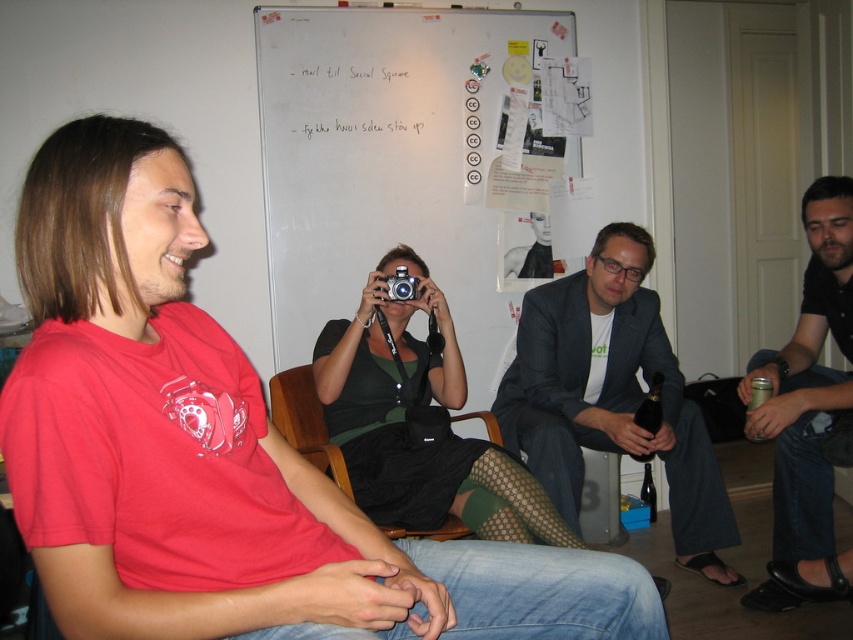
You are a guest at this gathering and want to sit down. There is a dark gray suit at center and a wooden armchair at center. Which one can you sit on?

The wooden armchair at center is behind the dark gray suit at center, so you can sit on the wooden armchair at center.